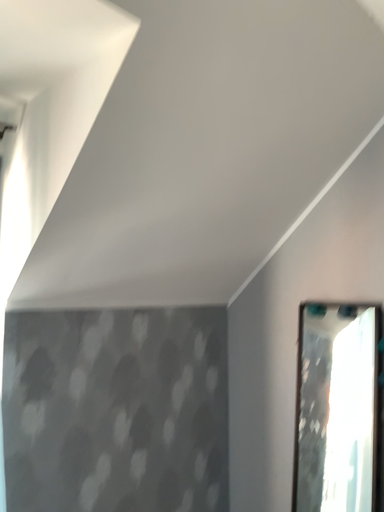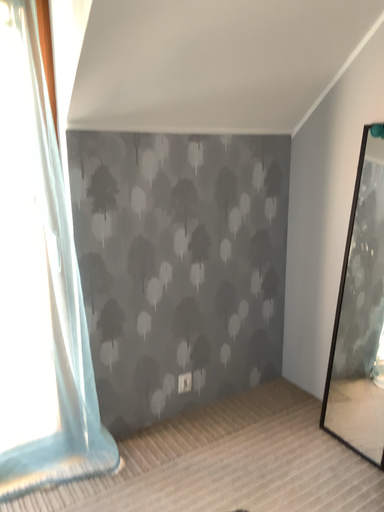
Question: How did the camera likely rotate when shooting the video?

Choices:
 (A) rotated downward
 (B) rotated upward

Answer: (A)